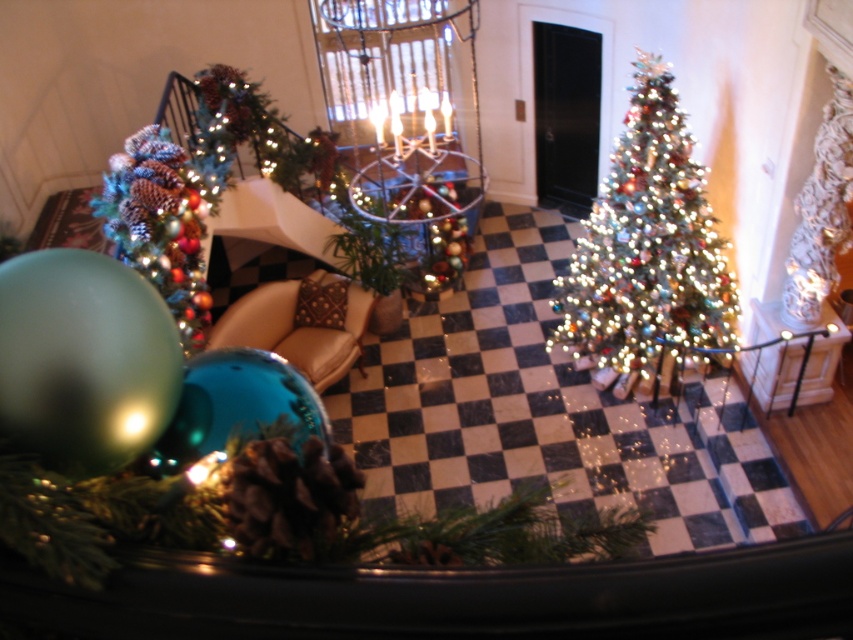
In the scene shown: Does shiny glass ornament at center appear on the left side of iridescent glass christmas tree at center?

Yes, shiny glass ornament at center is to the left of iridescent glass christmas tree at center.

Who is taller, shiny glass ornament at center or iridescent glass christmas tree at center?

iridescent glass christmas tree at center

Measure the distance between point (469, 561) and camera.

Point (469, 561) and camera are 37.32 inches apart.

Identify the location of shiny glass ornament at center. The height and width of the screenshot is (640, 853). (264, 492).

Between point (316, 534) and point (177, 307), which one is positioned behind?

Point (177, 307)

Find the location of a particular element. This screenshot has width=853, height=640. shiny glass ornament at center is located at coordinates (264, 492).

Where is `shiny glass ornament at center`? Image resolution: width=853 pixels, height=640 pixels. shiny glass ornament at center is located at coordinates (264, 492).

Who is lower down, iridescent glass christmas tree at center or shiny metallic ornament at left?

Positioned lower is shiny metallic ornament at left.

Is point (727, 294) more distant than point (166, 273)?

That is True.

The image size is (853, 640). Identify the location of iridescent glass christmas tree at center. (647, 248).

The width and height of the screenshot is (853, 640). I want to click on iridescent glass christmas tree at center, so click(x=647, y=248).